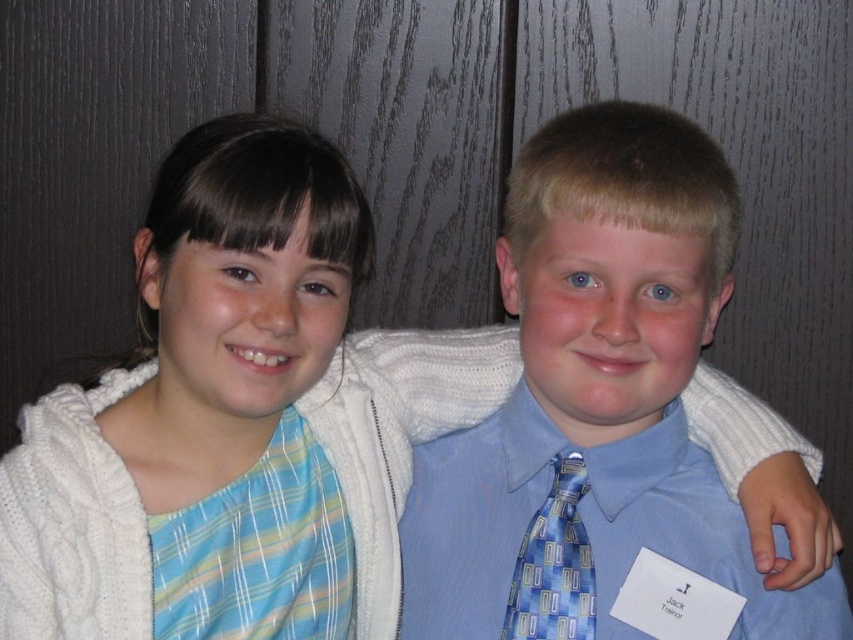
Can you confirm if blue satin tie at center is positioned below blue printed tie at center?

Actually, blue satin tie at center is above blue printed tie at center.

Is blue satin tie at center taller than blue printed tie at center?

Correct, blue satin tie at center is much taller as blue printed tie at center.

Measure the distance between blue satin tie at center and camera.

blue satin tie at center and camera are 29.22 inches apart from each other.

The width and height of the screenshot is (853, 640). In order to click on blue satin tie at center in this screenshot , I will do `click(595, 401)`.